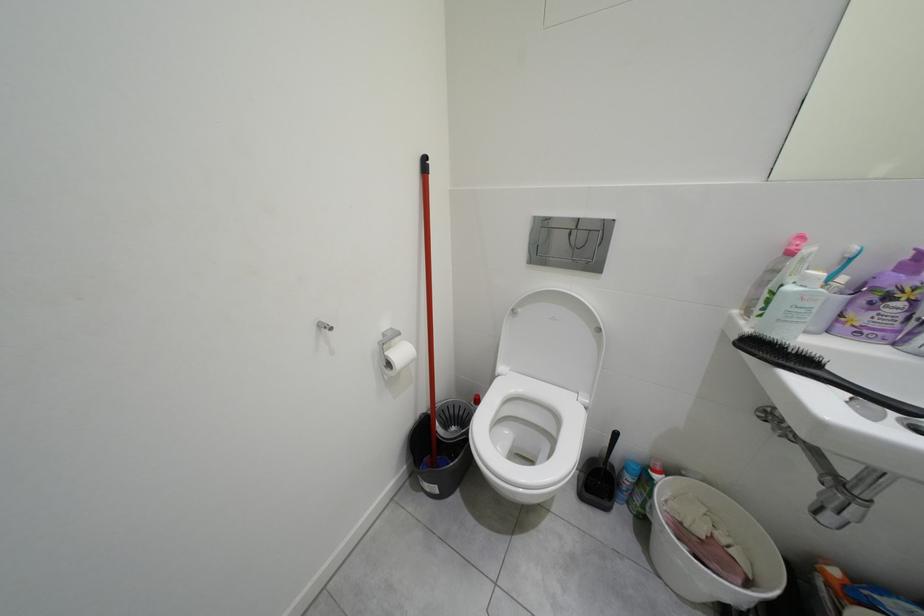
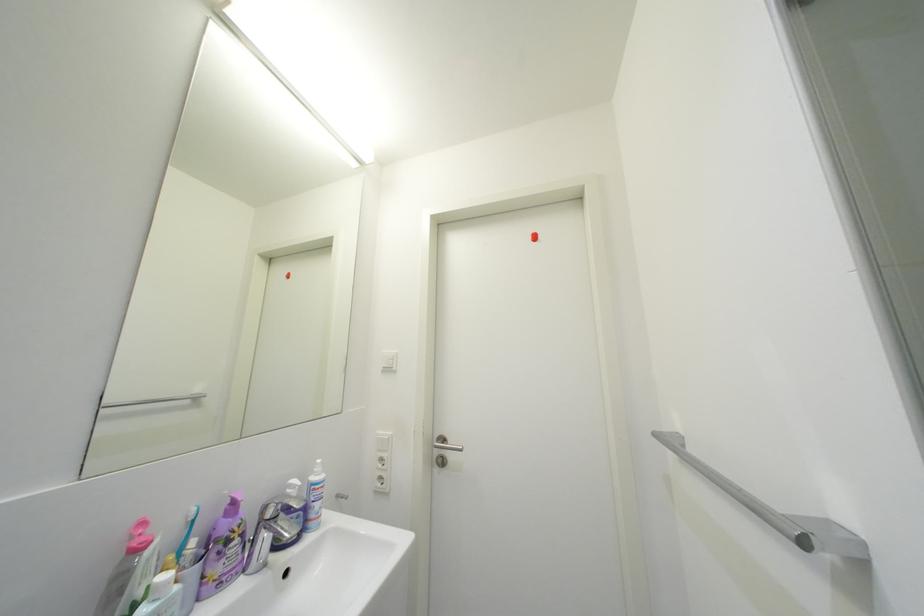
Question: The camera is either moving clockwise (left) or counter-clockwise (right) around the object. The first image is from the beginning of the video and the second image is from the end. Is the camera moving left or right when shooting the video?

Choices:
 (A) Left
 (B) Right

Answer: (A)